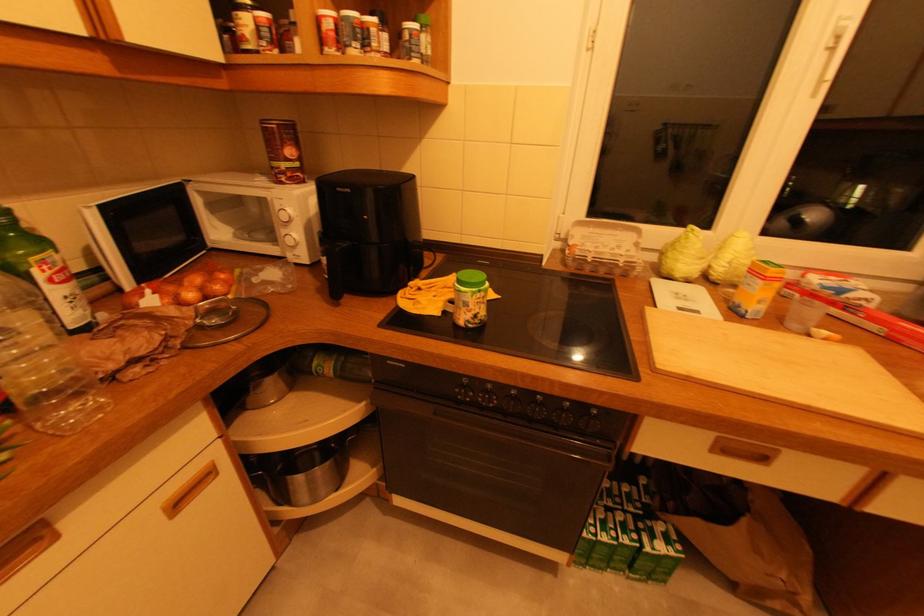
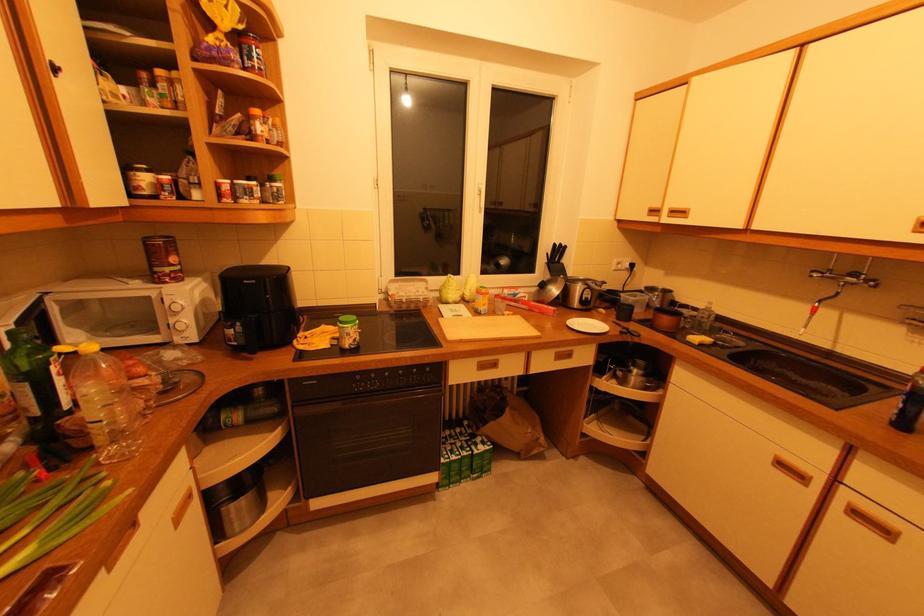
Locate, in the second image, the point that corresponds to (x=839, y=50) in the first image.

(482, 196)